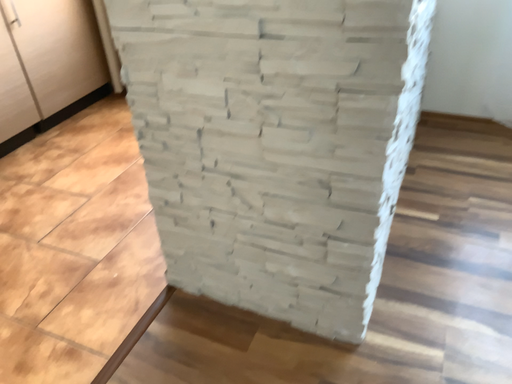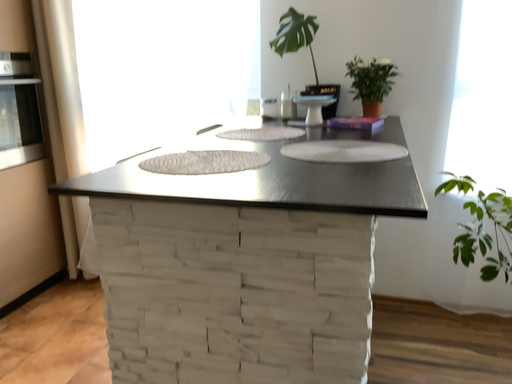
Question: Which way did the camera rotate in the video?

Choices:
 (A) rotated downward
 (B) rotated upward

Answer: (B)